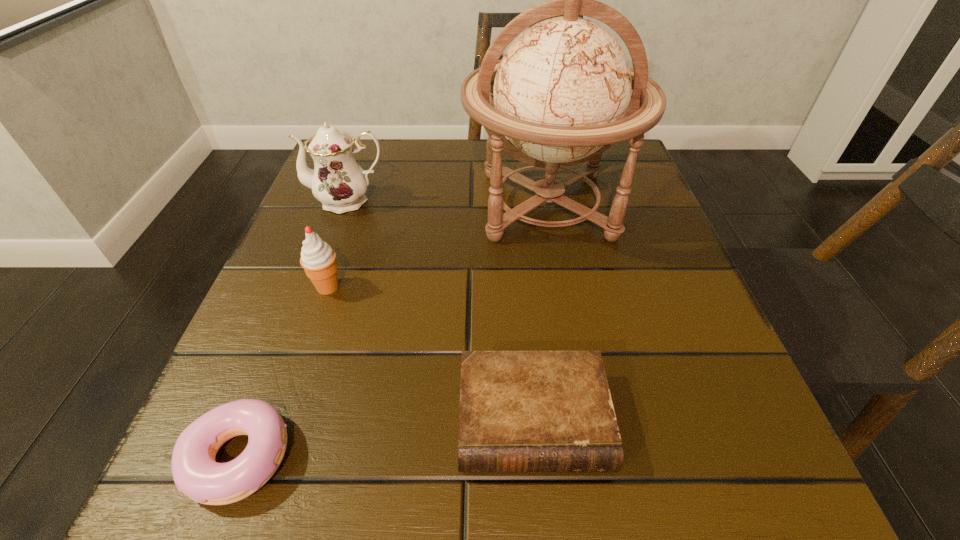
You are a GUI agent. You are given a task and a screenshot of the screen. Output one action in this format:
    pyautogui.click(x=<x>, y=<y>)
    Task: Click on the vacant area that lies between the diary and the third nearest object
    The image size is (960, 540).
    Given the screenshot: What is the action you would take?
    coord(430,354)

Where is `empty space that is in between the doughnut and the third nearest object`? empty space that is in between the doughnut and the third nearest object is located at coordinates (284, 372).

Find the location of a particular element. vacant area that lies between the diary and the icecream is located at coordinates (430, 354).

This screenshot has height=540, width=960. I want to click on empty space between the second tallest object and the doughnut, so click(294, 328).

You are a GUI agent. You are given a task and a screenshot of the screen. Output one action in this format:
    pyautogui.click(x=<x>, y=<y>)
    Task: Click on the vacant space that is in between the third nearest object and the doughnut
    
    Given the screenshot: What is the action you would take?
    pyautogui.click(x=284, y=372)

Where is `vacant area that lies between the chinaware and the doughnut`? The width and height of the screenshot is (960, 540). vacant area that lies between the chinaware and the doughnut is located at coordinates click(294, 328).

The height and width of the screenshot is (540, 960). Identify the location of empty space that is in between the tallest object and the second tallest object. (447, 203).

Where is `object that stands as the closest to the doughnut`? object that stands as the closest to the doughnut is located at coordinates (318, 259).

Locate which object ranks second in proximity to the doughnut. Please provide its 2D coordinates. Your answer should be formatted as a tuple, i.e. [(x, y)], where the tuple contains the x and y coordinates of a point satisfying the conditions above.

[(520, 411)]

Identify the location of blank area in the image that satisfies the following two spatial constraints: 1. on the front side of the third tallest object; 2. on the left side of the chinaware. The image size is (960, 540). (316, 287).